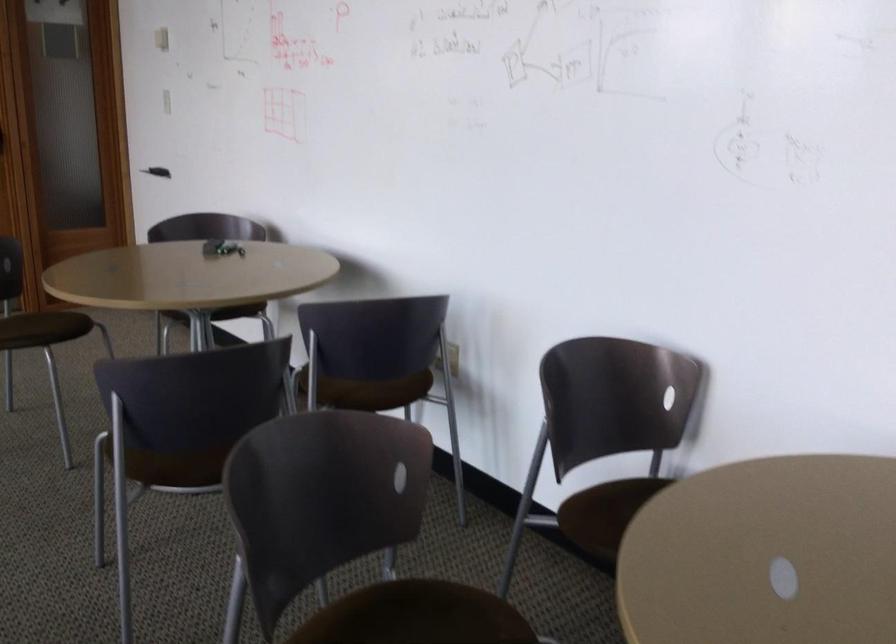
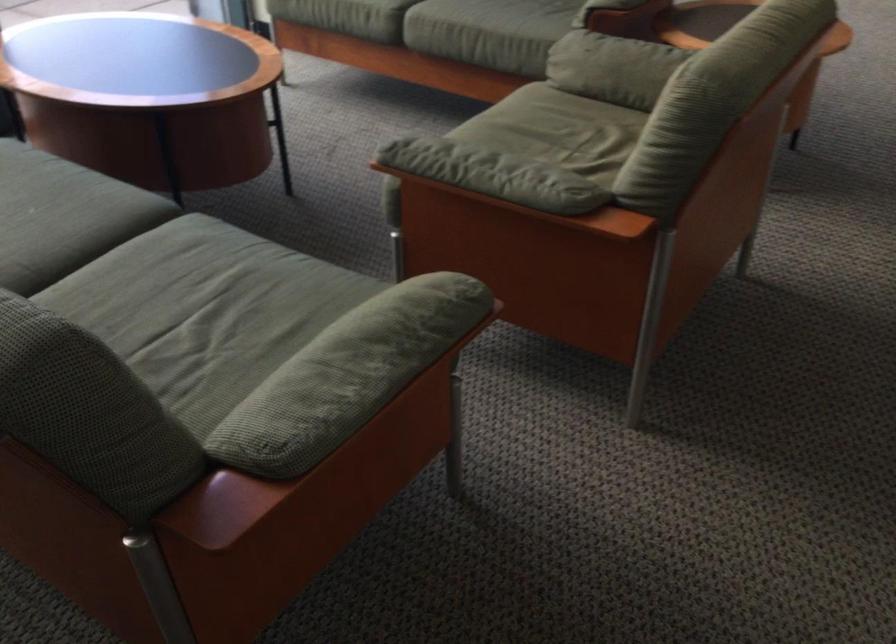
The first image is from the beginning of the video and the second image is from the end. How did the camera likely rotate when shooting the video?

The rotation direction of the camera is left-down.